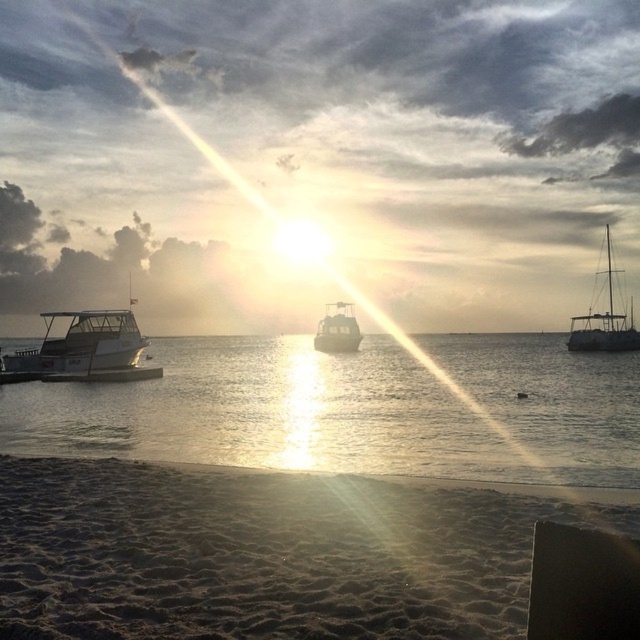
Does metallic silver boat at left appear over metallic silver boat at center?

Yes.

Can you confirm if metallic silver boat at left is smaller than metallic silver boat at center?

Incorrect, metallic silver boat at left is not smaller in size than metallic silver boat at center.

Describe the element at coordinates (83, 349) in the screenshot. The width and height of the screenshot is (640, 640). I see `metallic silver boat at left` at that location.

Where is `metallic silver boat at left`? This screenshot has width=640, height=640. metallic silver boat at left is located at coordinates (83, 349).

Is clear water at lower left thinner than satin white sailboat at right?

No.

You are a GUI agent. You are given a task and a screenshot of the screen. Output one action in this format:
    pyautogui.click(x=<x>, y=<y>)
    Task: Click on the clear water at lower left
    
    Given the screenshot: What is the action you would take?
    pyautogui.click(x=355, y=410)

Identify the location of clear water at lower left. (355, 410).

Who is higher up, sandy beach at lower left or metallic silver boat at center?

metallic silver boat at center is higher up.

Does sandy beach at lower left have a lesser width compared to metallic silver boat at center?

Yes, sandy beach at lower left is thinner than metallic silver boat at center.

This screenshot has width=640, height=640. Describe the element at coordinates (264, 554) in the screenshot. I see `sandy beach at lower left` at that location.

This screenshot has width=640, height=640. In order to click on sandy beach at lower left in this screenshot , I will do `click(264, 554)`.